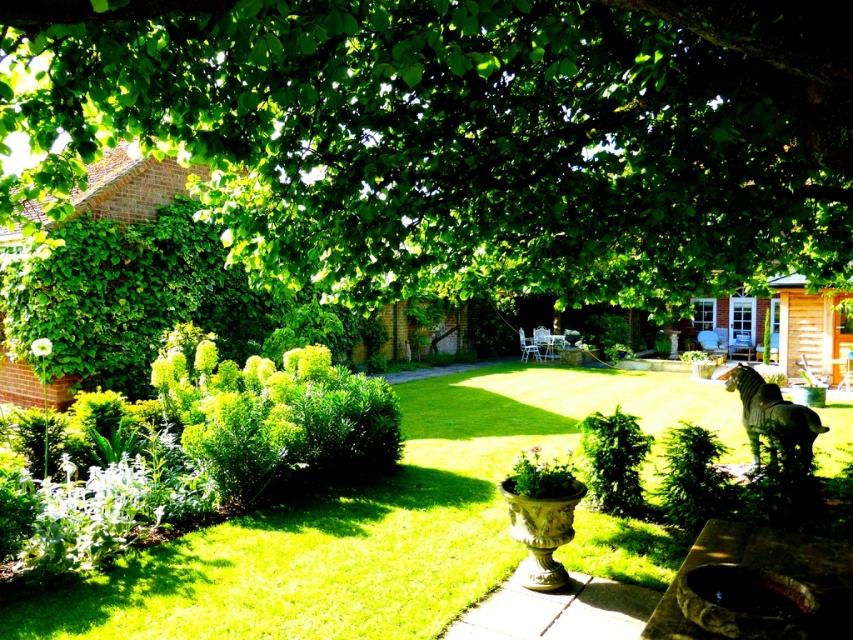
Which is above, green leafy tree at upper center or bronze statue at center?

green leafy tree at upper center is higher up.

Does point (718, 164) lie behind point (165, 636)?

Yes, point (718, 164) is behind point (165, 636).

Between point (820, 173) and point (349, 531), which one is positioned in front?

Point (349, 531) is more forward.

Where is `green leafy tree at upper center`? green leafy tree at upper center is located at coordinates (465, 134).